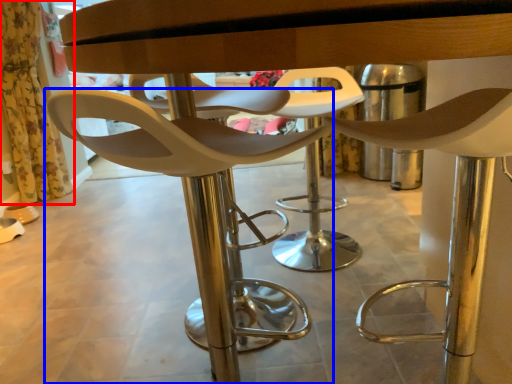
Question: Which object is closer to the camera taking this photo, curtain (highlighted by a red box) or chair (highlighted by a blue box)?

Choices:
 (A) curtain
 (B) chair

Answer: (B)